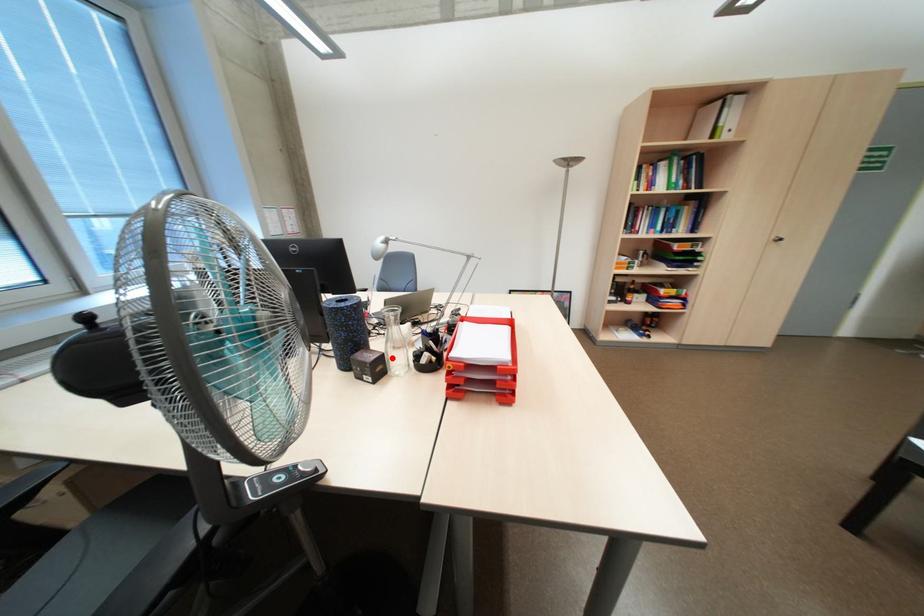
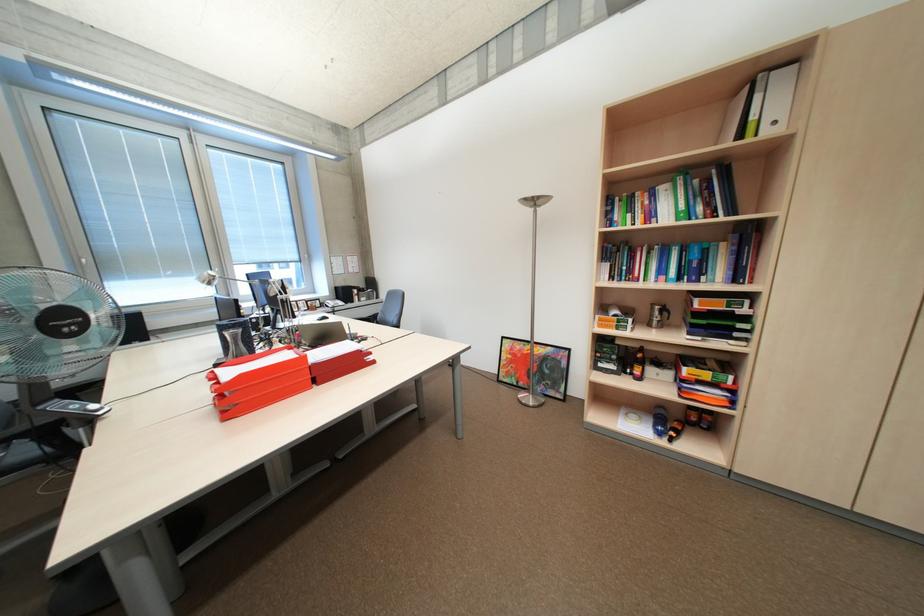
Question: I am providing you with two images of the same scene from different viewpoints. A red point is marked on the first image. At the location where the point appears in image 1, is it still visible in image 2?

Choices:
 (A) Yes
 (B) No

Answer: (B)